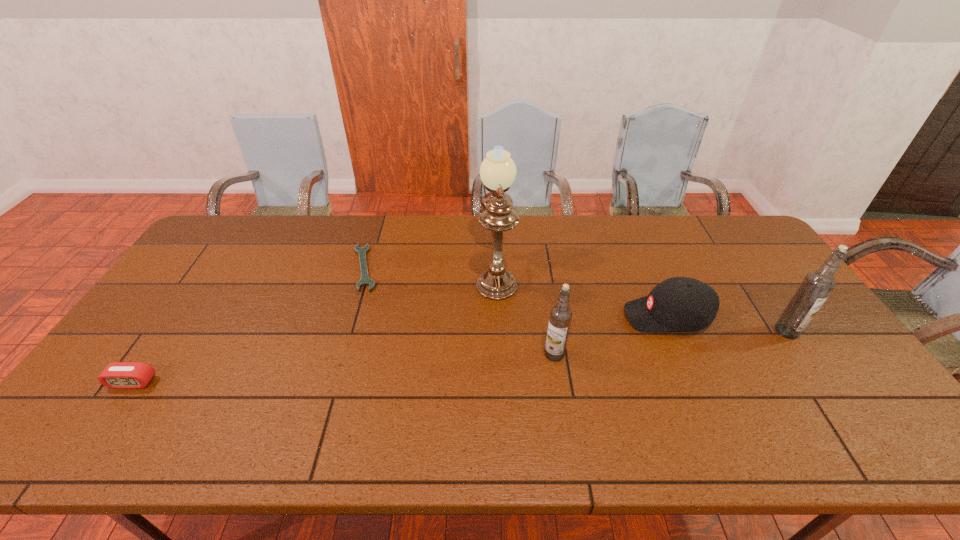
This screenshot has width=960, height=540. In order to click on vacant space in between the shortest object and the second shortest object in this screenshot , I will do `click(249, 325)`.

Image resolution: width=960 pixels, height=540 pixels. What are the coordinates of `free space between the taller vodka and the fourth shortest object` in the screenshot? It's located at (670, 343).

You are a GUI agent. You are given a task and a screenshot of the screen. Output one action in this format:
    pyautogui.click(x=<x>, y=<y>)
    Task: Click on the object that is the third nearest to the alarm clock
    The image size is (960, 540).
    Given the screenshot: What is the action you would take?
    pyautogui.click(x=560, y=318)

Identify the location of object that stands as the fourth closest to the fifth object from left to right. (365, 280).